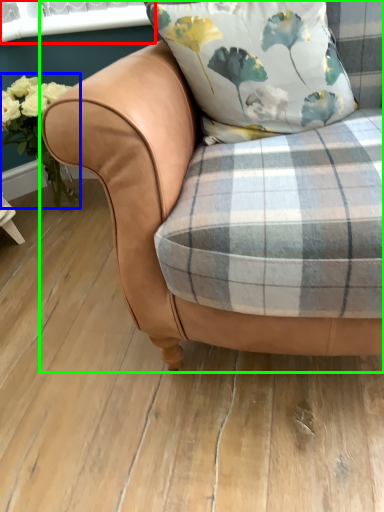
Question: Which is nearer to the window screen (highlighted by a red box)? floral arrangement (highlighted by a blue box) or chair (highlighted by a green box).

Choices:
 (A) floral arrangement
 (B) chair

Answer: (A)